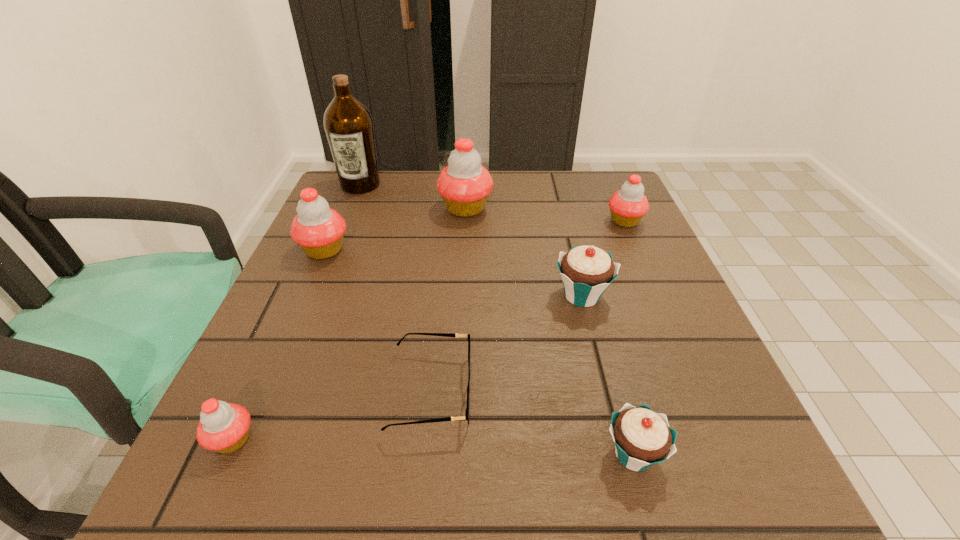
Where is `free point located on the front-facing side of the shortest object`? The image size is (960, 540). free point located on the front-facing side of the shortest object is located at coordinates (559, 391).

Image resolution: width=960 pixels, height=540 pixels. Find the location of `olive oil present at the far edge`. olive oil present at the far edge is located at coordinates (349, 127).

Locate an element on the screen. The height and width of the screenshot is (540, 960). olive oil that is at the left edge is located at coordinates (349, 127).

Locate an element on the screen. This screenshot has height=540, width=960. object present at the far left corner is located at coordinates (349, 127).

Find the location of `object that is at the near left corner`. object that is at the near left corner is located at coordinates (224, 427).

Identify the location of object at the far right corner. The height and width of the screenshot is (540, 960). (627, 206).

Locate an element on the screen. This screenshot has height=540, width=960. object situated at the near right corner is located at coordinates (642, 438).

This screenshot has width=960, height=540. In order to click on vacant space at the far edge in this screenshot , I will do `click(510, 182)`.

Identify the location of vacant space at the near edge. This screenshot has height=540, width=960. (581, 459).

The width and height of the screenshot is (960, 540). In the image, there is a desktop. Find the location of `free space at the left edge`. free space at the left edge is located at coordinates coord(350,245).